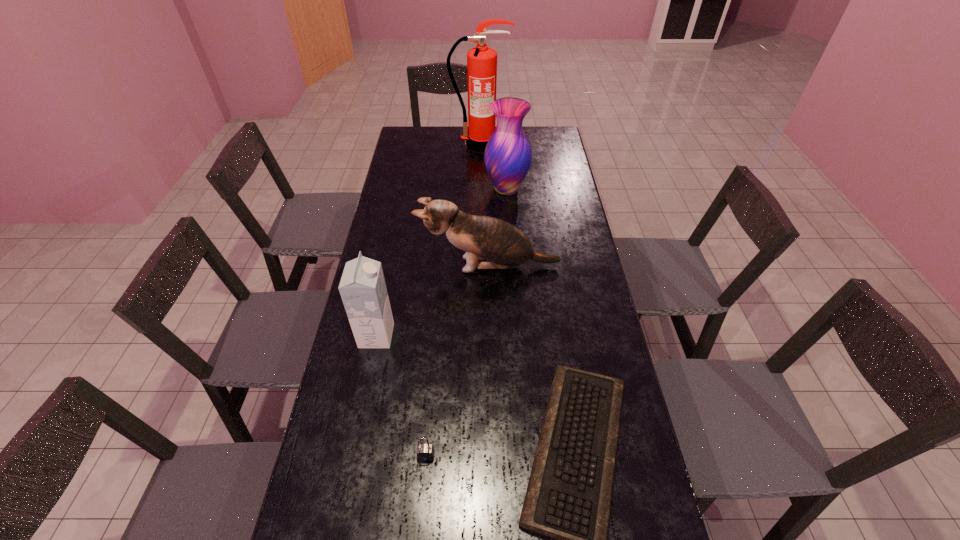
Locate an element on the screen. The width and height of the screenshot is (960, 540). vacant point located 0.060m at the face of the cat is located at coordinates (402, 265).

Identify the location of vacant space situated at the face of the cat. The height and width of the screenshot is (540, 960). (402, 265).

Locate an element on the screen. Image resolution: width=960 pixels, height=540 pixels. free region located at the face of the cat is located at coordinates (387, 265).

Where is `vacant space situated on the shackle of the second shortest object`? The image size is (960, 540). vacant space situated on the shackle of the second shortest object is located at coordinates (421, 507).

This screenshot has height=540, width=960. Identify the location of object present at the far edge. (481, 61).

You are a GUI agent. You are given a task and a screenshot of the screen. Output one action in this format:
    pyautogui.click(x=<x>, y=<y>)
    Task: Click on the object that is positioned at the left edge
    This screenshot has height=540, width=960.
    Given the screenshot: What is the action you would take?
    pyautogui.click(x=363, y=290)

The height and width of the screenshot is (540, 960). In order to click on object located at the right edge in this screenshot , I will do `click(484, 238)`.

This screenshot has width=960, height=540. I want to click on free space at the far edge of the desktop, so click(x=451, y=131).

Where is `free point at the left edge`? free point at the left edge is located at coordinates (371, 464).

The height and width of the screenshot is (540, 960). What are the coordinates of `vacant area at the right edge` in the screenshot? It's located at (576, 274).